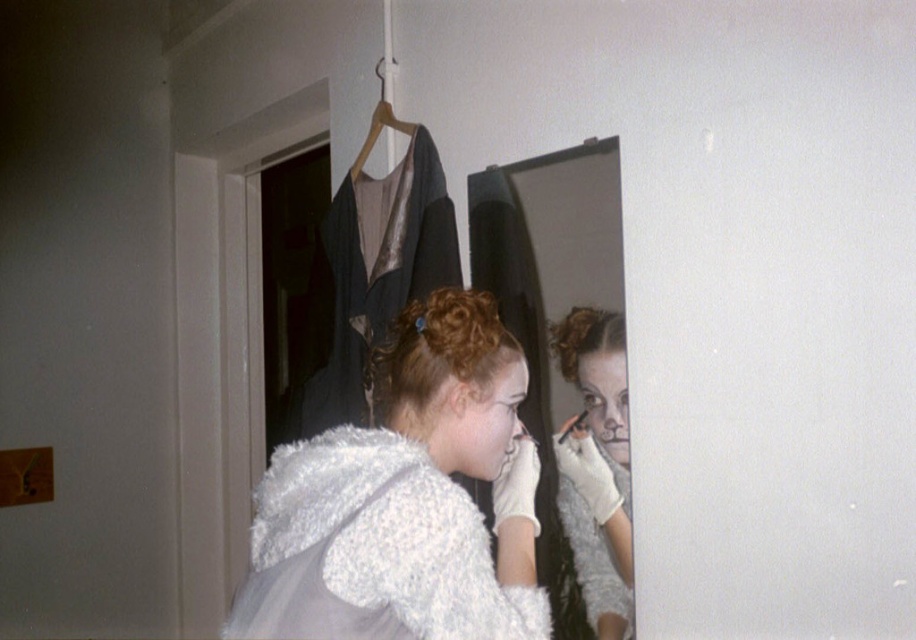
Does white fluffy coat at center have a lesser width compared to wooden hanger at upper center?

No, white fluffy coat at center is not thinner than wooden hanger at upper center.

Does white fluffy coat at center appear over wooden hanger at upper center?

No, white fluffy coat at center is not above wooden hanger at upper center.

Which is in front, point (333, 592) or point (377, 125)?

Point (333, 592) is more forward.

Locate an element on the screen. This screenshot has height=640, width=916. white fluffy coat at center is located at coordinates (407, 499).

Which is more to the right, curly blonde hair at center or wooden hanger at upper center?

From the viewer's perspective, curly blonde hair at center appears more on the right side.

Is curly blonde hair at center thinner than wooden hanger at upper center?

No.

Which is in front, point (515, 358) or point (415, 125)?

Point (515, 358)

The height and width of the screenshot is (640, 916). What are the coordinates of `curly blonde hair at center` in the screenshot? It's located at (437, 358).

From the picture: Between white fluffy coat at center and curly blonde hair at mirror center, which one appears on the right side from the viewer's perspective?

curly blonde hair at mirror center

Consider the image. Is white fluffy coat at center to the left of curly blonde hair at mirror center from the viewer's perspective?

Yes, white fluffy coat at center is to the left of curly blonde hair at mirror center.

Is point (470, 458) behind point (571, 344)?

No.

This screenshot has height=640, width=916. I want to click on white fluffy coat at center, so click(x=407, y=499).